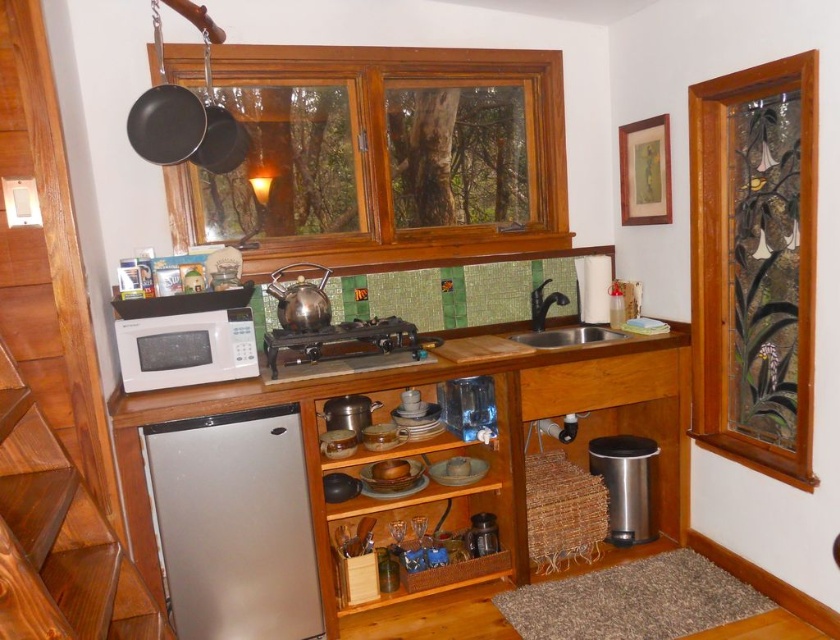
Question: Which object is the farthest from the stained glass window at right?

Choices:
 (A) white matte microwave at left
 (B) satin silver sink at center

Answer: (A)

Question: Based on their relative distances, which object is farther from the stainless steel trash can at lower right?

Choices:
 (A) satin silver sink at center
 (B) stained glass window at right

Answer: (B)

Question: Which point is closer to the camera?

Choices:
 (A) (772, 296)
 (B) (323, 328)

Answer: (A)

Question: Is white matte microwave at center to the left of black cast iron stove at center from the viewer's perspective?

Choices:
 (A) yes
 (B) no

Answer: (A)

Question: Does wooden frame at upper center have a larger size compared to satin silver dishwasher at lower left?

Choices:
 (A) no
 (B) yes

Answer: (B)

Question: Is stained glass window at right below black cast iron stove at center?

Choices:
 (A) no
 (B) yes

Answer: (A)